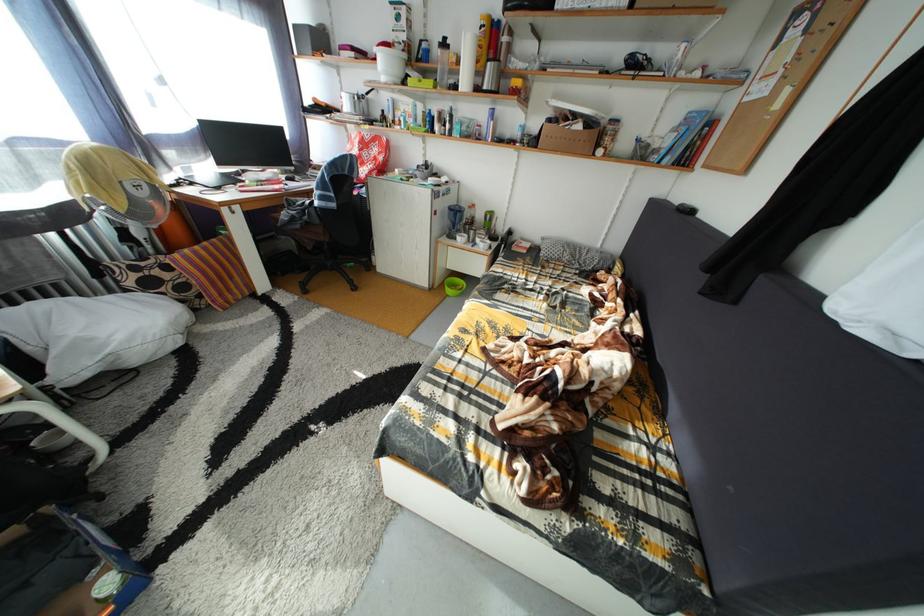
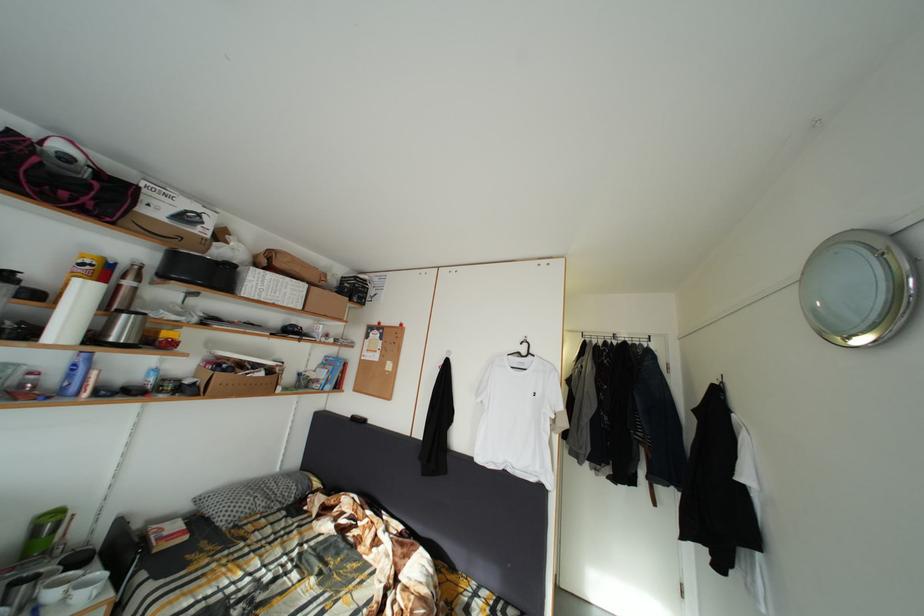
In the second image, find the point that corresponds to point 585,123 in the first image.

(264, 373)